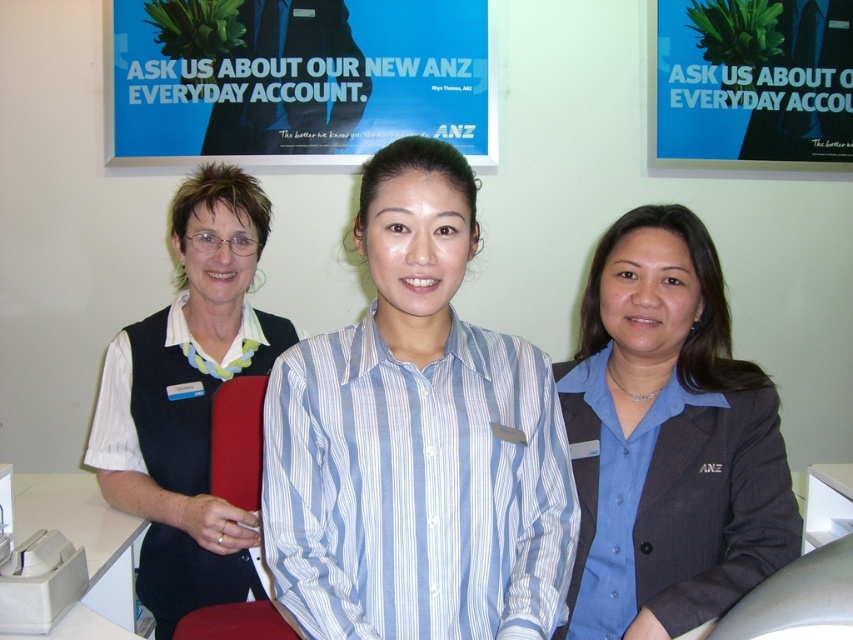
You are a photographer who needs to take a photo of the blue textured blazer at center. The camera you are holding is 1.12 meters away from the blazer. Is the distance sufficient for a clear photo?

The blue textured blazer at center and camera are 1.12 meters apart, so yes, the distance is sufficient for a clear photo.

You are a customer service representative in a bank. You need to determine which item is narrower between the blue striped shirt at center and the blue paper at upper center. Which one is it?

The blue striped shirt at center has a lesser width compared to the blue paper at upper center, so the blue striped shirt at center is narrower.

You are an interior designer planning to place a small decorative item between the blue textured blazer at center and the blue paper at upper center. Given their sizes, which object should the item be placed closer to?

The blue paper at upper center is smaller in size than the blue textured blazer at center, so the decorative item should be placed closer to the blue paper at upper center to balance the visual weight.